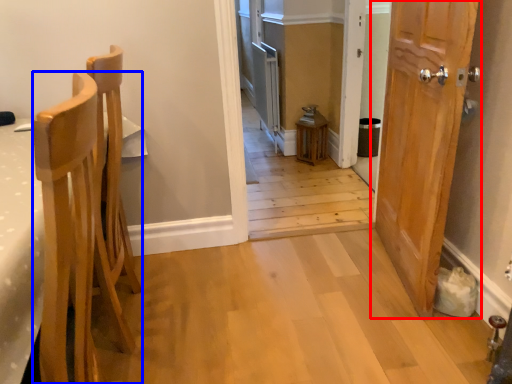
Question: Which of the following is the farthest to the observer, door (highlighted by a red box) or chair (highlighted by a blue box)?

Choices:
 (A) door
 (B) chair

Answer: (A)